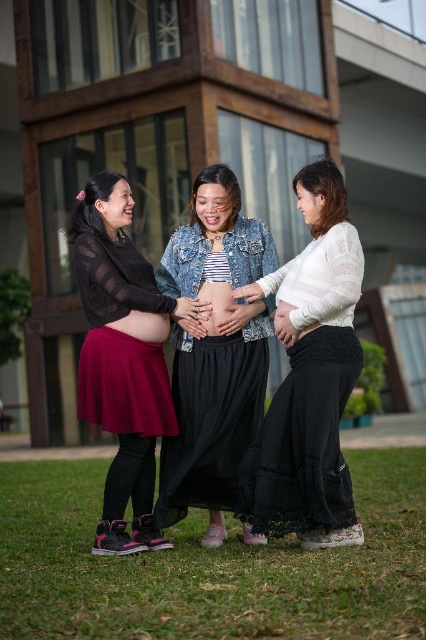
You are standing at the camera position and want to throw a ball to hit the point at coordinates point (328, 161). If your throwing range is up to 6 meters, will you be able to reach that point?

The distance of point (328, 161) from camera is 6.23 meters, which is beyond your throwing range of 6 meters. Therefore, you won

Based on the scene description, which object is positioned lower on the middle woman between the denim jacket at center and the matte skin at center?

The denim jacket at center is positioned lower than the matte skin at center on the middle woman.